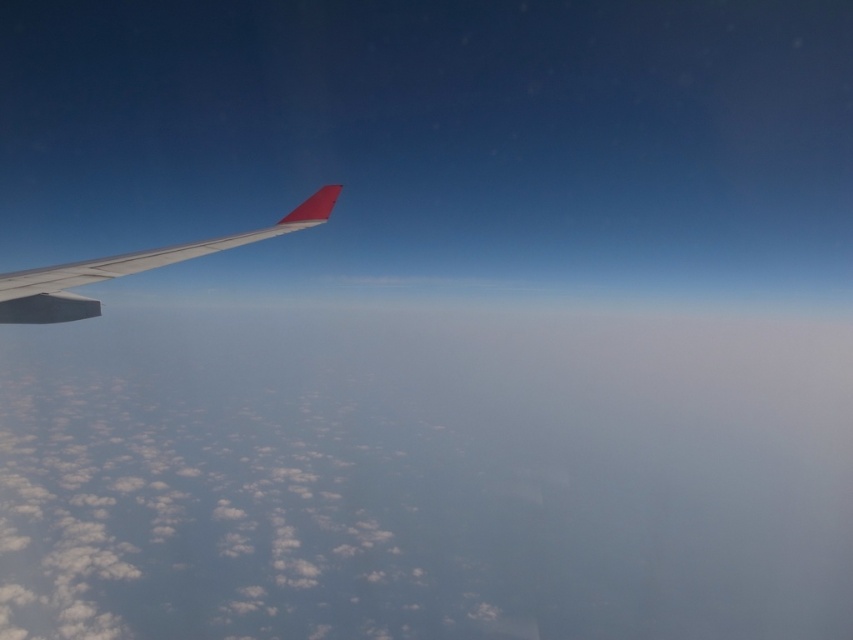
You are a pilot checking the aircraft wing during flight. You notice two points on the wing, one at point coordinates point (421, 438) and the other at point coordinates point (128, 260). Which point is closer to the cockpit?

Point (128, 260) is closer to the cockpit because it is closer to the viewer compared to point (421, 438) which is further away.

You are a pilot flying at an altitude where the clouds are below you. You notice a point in the sky at coordinates point (424, 476). What is located at that point?

At point (424, 476) lies white fluffy cloud at lower left.

You are a pilot checking the aircraft wing for potential obstructions. From your current position inside the cockpit, you notice the white fluffy cloud at lower left and the metallic gray wing at left. Which object appears wider when viewed from your perspective?

The white fluffy cloud at lower left might be wider than metallic gray wing at left according to the description.